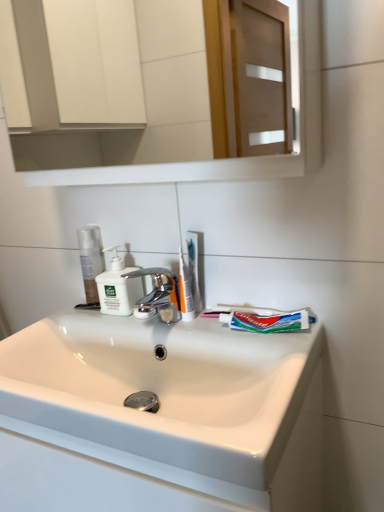
This screenshot has width=384, height=512. What do you see at coordinates (54, 87) in the screenshot? I see `white glossy mirror at upper center` at bounding box center [54, 87].

At what (x,y) coordinates should I click in order to perform the action: click on white matte soap dispenser at center. Please return your answer as a coordinate pair (x, y). This screenshot has height=512, width=384. Looking at the image, I should click on (118, 287).

The height and width of the screenshot is (512, 384). In order to click on white glossy sink at center in this screenshot , I will do `click(162, 395)`.

What do you see at coordinates (162, 395) in the screenshot? This screenshot has height=512, width=384. I see `white glossy sink at center` at bounding box center [162, 395].

You are a GUI agent. You are given a task and a screenshot of the screen. Output one action in this format:
    pyautogui.click(x=<x>, y=<y>)
    Task: Click on the chrome metallic faucet at center
    The width and height of the screenshot is (384, 512).
    Given the screenshot: What is the action you would take?
    pyautogui.click(x=158, y=295)

Looking at this image, is white matte soap dispenser at center positioned beyond the bounds of translucent plastic toothbrush at center?

Indeed, white matte soap dispenser at center is completely outside translucent plastic toothbrush at center.

From the picture: Is white matte soap dispenser at center closer to camera compared to translucent plastic toothbrush at center?

No, the depth of white matte soap dispenser at center is greater than that of translucent plastic toothbrush at center.

What's the angular difference between white matte soap dispenser at center and translucent plastic toothbrush at center's facing directions?

The facing directions of white matte soap dispenser at center and translucent plastic toothbrush at center are 5.41 degrees apart.

Is white matte soap dispenser at center aimed at translucent plastic toothbrush at center?

No, white matte soap dispenser at center is not oriented towards translucent plastic toothbrush at center.

Would you say chrome metallic faucet at center is inside or outside white glossy mirror at upper center?

chrome metallic faucet at center lies outside white glossy mirror at upper center.

Who is bigger, chrome metallic faucet at center or white glossy mirror at upper center?

white glossy mirror at upper center is bigger.

Is chrome metallic faucet at center shorter than white glossy mirror at upper center?

Indeed, chrome metallic faucet at center has a lesser height compared to white glossy mirror at upper center.

Is the position of chrome metallic faucet at center more distant than that of white glossy mirror at upper center?

Yes, it is.

Considering the relative sizes of chrome metallic faucet at center and green matte toothpaste at center in the image provided, is chrome metallic faucet at center smaller than green matte toothpaste at center?

No, chrome metallic faucet at center is not smaller than green matte toothpaste at center.

How different are the orientations of chrome metallic faucet at center and green matte toothpaste at center in degrees?

The facing directions of chrome metallic faucet at center and green matte toothpaste at center are 4.12 degrees apart.

Is chrome metallic faucet at center to the left of green matte toothpaste at center from the viewer's perspective?

Indeed, chrome metallic faucet at center is positioned on the left side of green matte toothpaste at center.

Would you say green matte toothpaste at center is part of chrome metallic faucet at center's contents?

No, green matte toothpaste at center is not surrounded by chrome metallic faucet at center.

What's the angular difference between translucent plastic toothbrush at center and white matte soap dispenser at center's facing directions?

The facing directions of translucent plastic toothbrush at center and white matte soap dispenser at center are 8.81 degrees apart.

The width and height of the screenshot is (384, 512). What are the coordinates of `soap dispenser below the translucent plastic toothbrush at center (from the image's perspective)` in the screenshot? It's located at (118, 287).

Is translucent plastic toothbrush at center far away from white matte soap dispenser at center?

translucent plastic toothbrush at center is actually quite close to white matte soap dispenser at center.

Between translucent plastic toothbrush at center and white matte soap dispenser at center, which one has smaller size?

With smaller size is translucent plastic toothbrush at center.

Can you confirm if translucent plastic toothbrush at center is wider than white matte soap dispenser at center?

No, translucent plastic toothbrush at center is not wider than white matte soap dispenser at center.

Is white glossy mirror at upper center oriented away from translucent plastic toothbrush at center?

white glossy mirror at upper center does not have its back to translucent plastic toothbrush at center.

Is the depth of white glossy mirror at upper center less than that of translucent plastic toothbrush at center?

Yes, it is.

Which is behind, point (38, 151) or point (187, 298)?

Positioned behind is point (38, 151).

Considering the sizes of objects translucent plastic toothbrush at center and translucent plastic toothbrush at center in the image provided, who is bigger, translucent plastic toothbrush at center or translucent plastic toothbrush at center?

translucent plastic toothbrush at center.

From a real-world perspective, which is physically below, translucent plastic toothbrush at center or translucent plastic toothbrush at center?

translucent plastic toothbrush at center.

Does translucent plastic toothbrush at center lie in front of translucent plastic toothbrush at center?

Yes, it is in front of translucent plastic toothbrush at center.

Locate an element on the screen. toiletry located above the white matte soap dispenser at center (from the image's perspective) is located at coordinates (185, 291).

In order to click on mirror lying in front of the chrome metallic faucet at center in this screenshot , I will do `click(54, 87)`.

Looking at the image, which one is located closer to translucent plastic toothbrush at center, green matte toothpaste at center or white glossy sink at center?

The object closer to translucent plastic toothbrush at center is green matte toothpaste at center.

Considering their positions, is white matte soap dispenser at center positioned closer to clear plastic bottle at left than translucent plastic toothbrush at center?

white matte soap dispenser at center lies closer to clear plastic bottle at left than the other object.

Considering their positions, is clear plastic bottle at left positioned further to translucent plastic toothbrush at center than white matte soap dispenser at center?

The object further to translucent plastic toothbrush at center is clear plastic bottle at left.

Based on their spatial positions, is translucent plastic toothbrush at center or white matte soap dispenser at center further from chrome metallic faucet at center?

translucent plastic toothbrush at center lies further to chrome metallic faucet at center than the other object.

When comparing their distances from white matte soap dispenser at center, does green matte toothpaste at center or chrome metallic faucet at center seem closer?

chrome metallic faucet at center lies closer to white matte soap dispenser at center than the other object.

Estimate the real-world distances between objects in this image. Which object is further from green matte toothpaste at center, clear plastic bottle at left or white matte soap dispenser at center?

clear plastic bottle at left is further to green matte toothpaste at center.

Looking at the image, which one is located further to white glossy mirror at upper center, chrome metallic faucet at center or white glossy sink at center?

The object further to white glossy mirror at upper center is white glossy sink at center.

Considering their positions, is clear plastic bottle at left positioned closer to chrome metallic faucet at center than white glossy sink at center?

The object closer to chrome metallic faucet at center is clear plastic bottle at left.

In order to click on toiletry between white glossy mirror at upper center and clear plastic bottle at left along the z-axis in this screenshot , I will do `click(185, 291)`.

The image size is (384, 512). What are the coordinates of `toothbrush between white glossy mirror at upper center and translucent plastic toothbrush at center in the up-down direction` in the screenshot? It's located at (194, 269).

Find the location of `toiletry between white glossy mirror at upper center and white matte soap dispenser at center in the up-down direction`. toiletry between white glossy mirror at upper center and white matte soap dispenser at center in the up-down direction is located at coordinates (185, 291).

Where is `toiletry that lies between white glossy mirror at upper center and chrome metallic faucet at center from top to bottom`? toiletry that lies between white glossy mirror at upper center and chrome metallic faucet at center from top to bottom is located at coordinates 185,291.